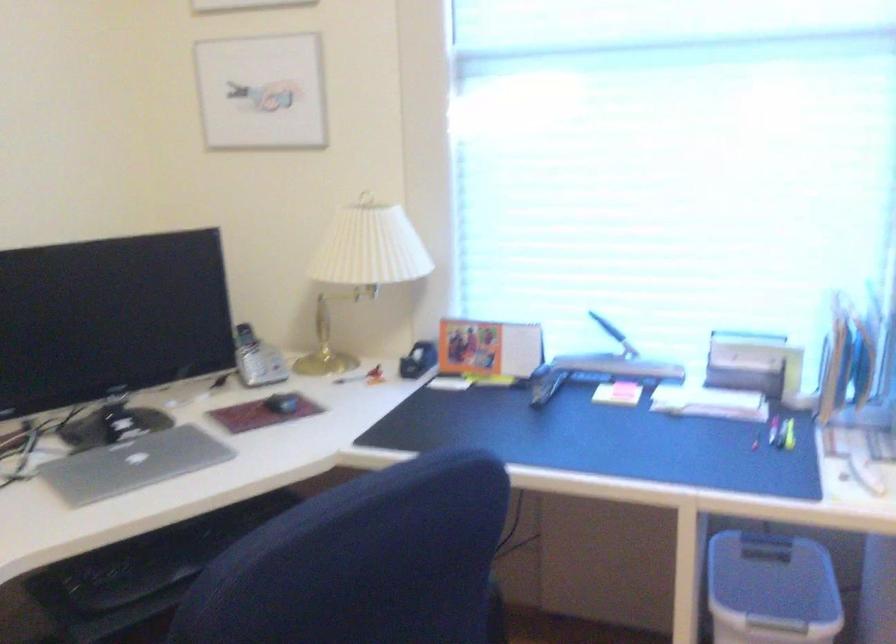
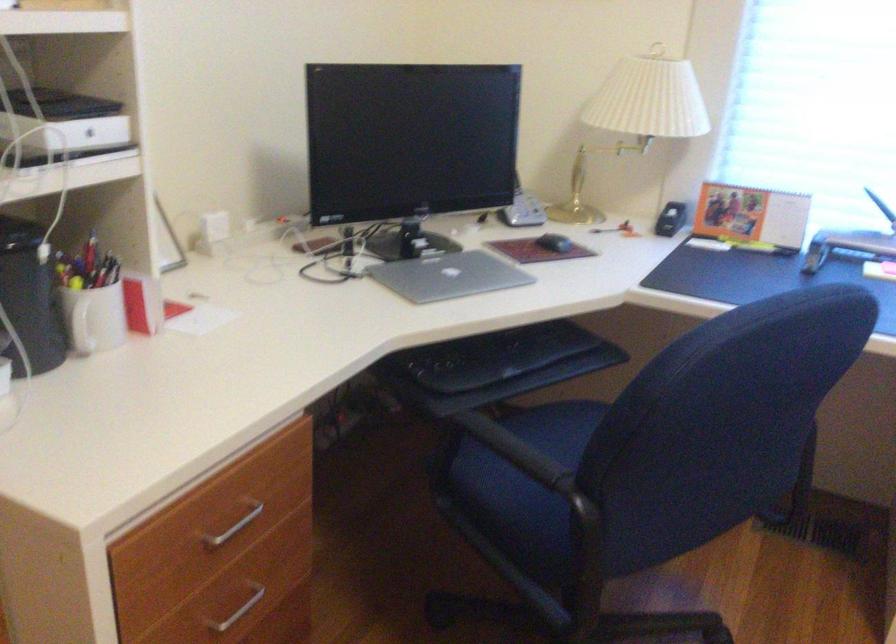
In the second image, find the point that corresponds to [133,465] in the first image.

(449, 276)